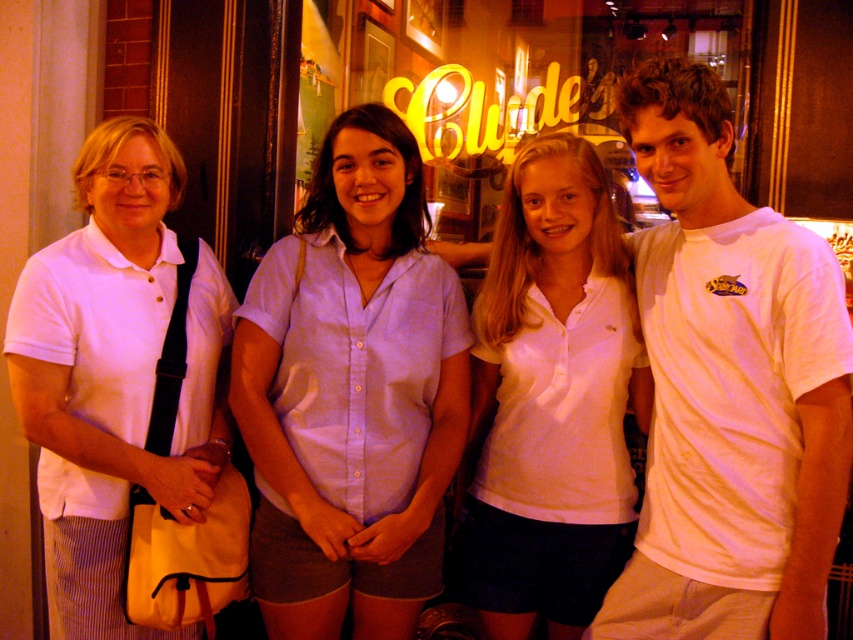
Who is higher up, white cotton t-shirt at right or white matte shirt at left?

Positioned higher is white cotton t-shirt at right.

Is white cotton t-shirt at right above white matte shirt at left?

Yes.

Which is behind, point (828, 324) or point (74, 246)?

The point (74, 246) is more distant.

At what (x,y) coordinates should I click in order to perform the action: click on white cotton t-shirt at right. Please return your answer as a coordinate pair (x, y). This screenshot has width=853, height=640. Looking at the image, I should click on (729, 387).

Does purple cotton shirt at center appear on the right side of yellow neon sign at upper center?

In fact, purple cotton shirt at center is to the left of yellow neon sign at upper center.

Is purple cotton shirt at center positioned at the back of yellow neon sign at upper center?

No, it is not.

Measure the distance between point (366, 262) and camera.

A distance of 7.02 feet exists between point (366, 262) and camera.

Find the location of a particular element. The width and height of the screenshot is (853, 640). purple cotton shirt at center is located at coordinates (352, 394).

Is purple cotton shirt at center taller than white matte shirt at left?

Yes.

Which of these two, purple cotton shirt at center or white matte shirt at left, stands taller?

purple cotton shirt at center is taller.

Is point (264, 449) positioned after point (209, 419)?

No, (264, 449) is in front of (209, 419).

In order to click on purple cotton shirt at center in this screenshot , I will do pyautogui.click(x=352, y=394).